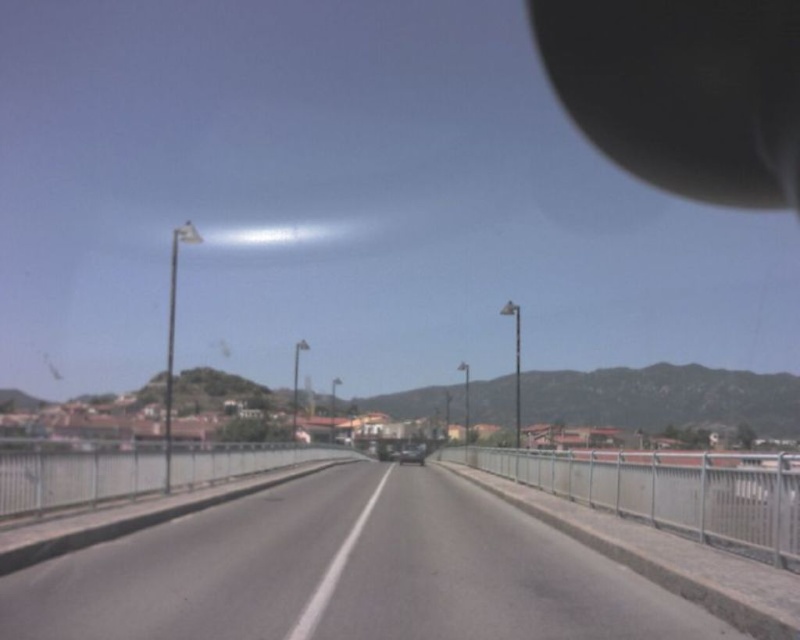
Question: Among these points, which one is farthest from the camera?

Choices:
 (A) (541, 580)
 (B) (414, 460)
 (C) (760, 45)

Answer: (C)

Question: Which of the following is the farthest from the observer?

Choices:
 (A) gray asphalt highway at center
 (B) metallic silver car at center
 (C) matte black view mirror at upper right

Answer: (B)

Question: Based on their relative distances, which object is nearer to the metallic silver car at center?

Choices:
 (A) gray asphalt highway at center
 (B) matte black view mirror at upper right

Answer: (A)

Question: Is matte black view mirror at upper right to the left of metallic silver car at center from the viewer's perspective?

Choices:
 (A) yes
 (B) no

Answer: (B)

Question: Does gray asphalt highway at center have a larger size compared to matte black view mirror at upper right?

Choices:
 (A) no
 (B) yes

Answer: (A)

Question: Is gray asphalt highway at center below matte black view mirror at upper right?

Choices:
 (A) yes
 (B) no

Answer: (A)